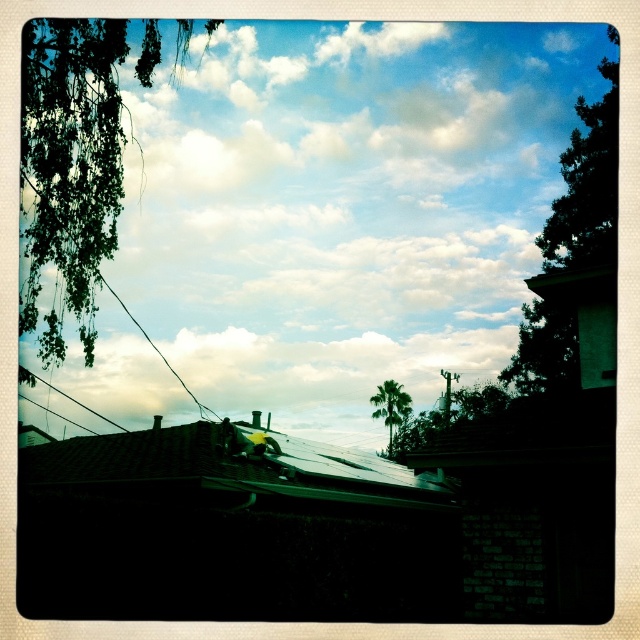
Question: Can you confirm if green leafy branches at upper left is positioned above green leafy tree at upper right?

Choices:
 (A) yes
 (B) no

Answer: (B)

Question: Does green tile roof at lower left appear under green leafy palm at upper center?

Choices:
 (A) no
 (B) yes

Answer: (A)

Question: Estimate the real-world distances between objects in this image. Which object is closer to the green tile roof at lower left?

Choices:
 (A) green leafy palm at upper center
 (B) green leafy tree at upper right

Answer: (B)

Question: Which object is the closest to the green leafy branches at upper left?

Choices:
 (A) green leafy tree at upper right
 (B) green tile roof at lower left
 (C) green leafy palm at upper center
 (D) white fluffy cloud at upper center

Answer: (B)

Question: Which of the following is the farthest from the observer?

Choices:
 (A) white fluffy cloud at upper center
 (B) green leafy branches at upper left
 (C) green leafy tree at upper right

Answer: (A)

Question: Can you confirm if green tile roof at lower left is thinner than green leafy palm at upper center?

Choices:
 (A) yes
 (B) no

Answer: (B)